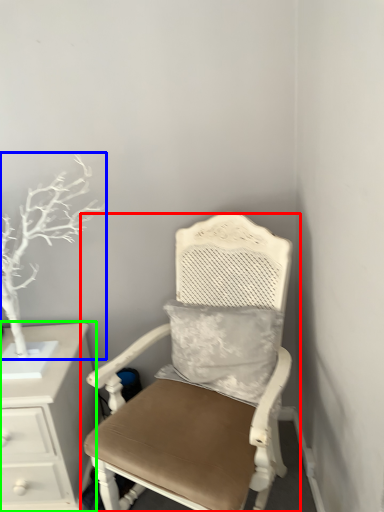
Question: Which object is positioned closest to chair (highlighted by a red box)? Select from tree (highlighted by a blue box) and chest of drawers (highlighted by a green box).

Choices:
 (A) tree
 (B) chest of drawers

Answer: (B)